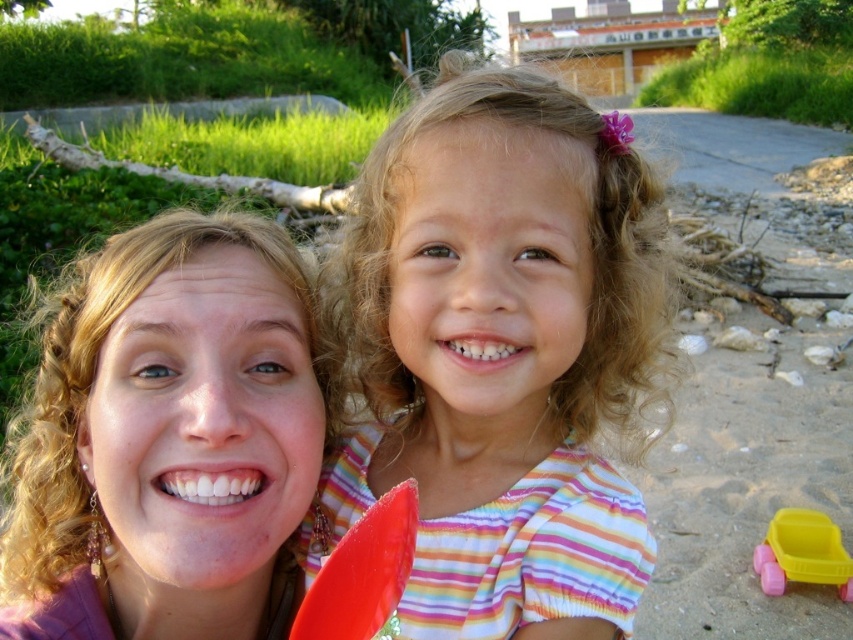
Which of these two, matte purple shirt at center or yellow plastic toy car at lower right, stands shorter?

yellow plastic toy car at lower right is shorter.

Is point (164, 573) in front of point (798, 564)?

Yes.

This screenshot has height=640, width=853. Find the location of `matte purple shirt at center`. matte purple shirt at center is located at coordinates (170, 435).

Identify the location of matte striped shirt at center. (503, 353).

Can you confirm if matte striped shirt at center is taller than matte purple shirt at center?

Correct, matte striped shirt at center is much taller as matte purple shirt at center.

Between point (419, 232) and point (35, 500), which one is positioned in front?

Point (419, 232)

Find the location of a particular element. Image resolution: width=853 pixels, height=640 pixels. matte striped shirt at center is located at coordinates (503, 353).

Does matte striped shirt at center have a lesser height compared to yellow plastic toy car at lower right?

Incorrect, matte striped shirt at center's height does not fall short of yellow plastic toy car at lower right's.

What do you see at coordinates (503, 353) in the screenshot? I see `matte striped shirt at center` at bounding box center [503, 353].

This screenshot has width=853, height=640. Find the location of `matte striped shirt at center`. matte striped shirt at center is located at coordinates (503, 353).

In order to click on matte striped shirt at center in this screenshot , I will do `click(503, 353)`.